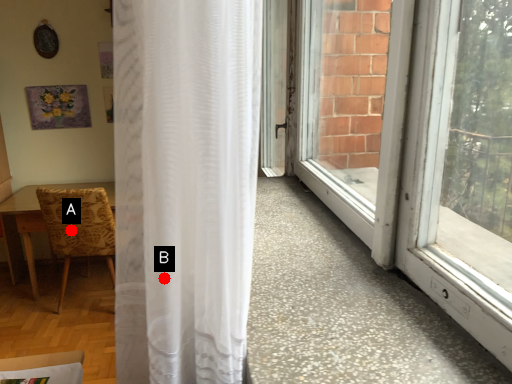
Question: Two points are circled on the image, labeled by A and B beside each circle. Which point is closer to the camera?

Choices:
 (A) A is closer
 (B) B is closer

Answer: (B)